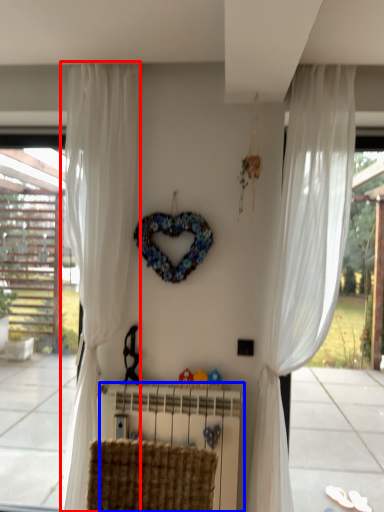
Question: Which object appears closest to the camera in this image, curtain (highlighted by a red box) or radiator (highlighted by a blue box)?

Choices:
 (A) curtain
 (B) radiator

Answer: (A)